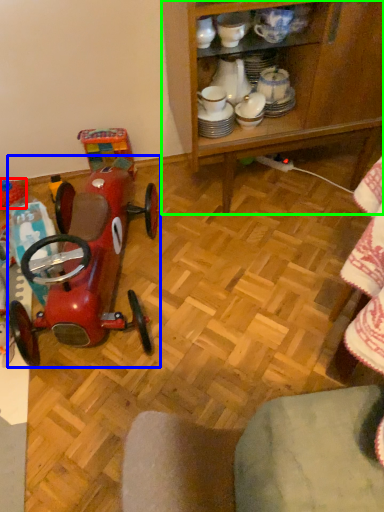
Question: Which is nearer to the toy (highlighted by a red box)? toy (highlighted by a blue box) or cabinetry (highlighted by a green box).

Choices:
 (A) toy
 (B) cabinetry

Answer: (A)